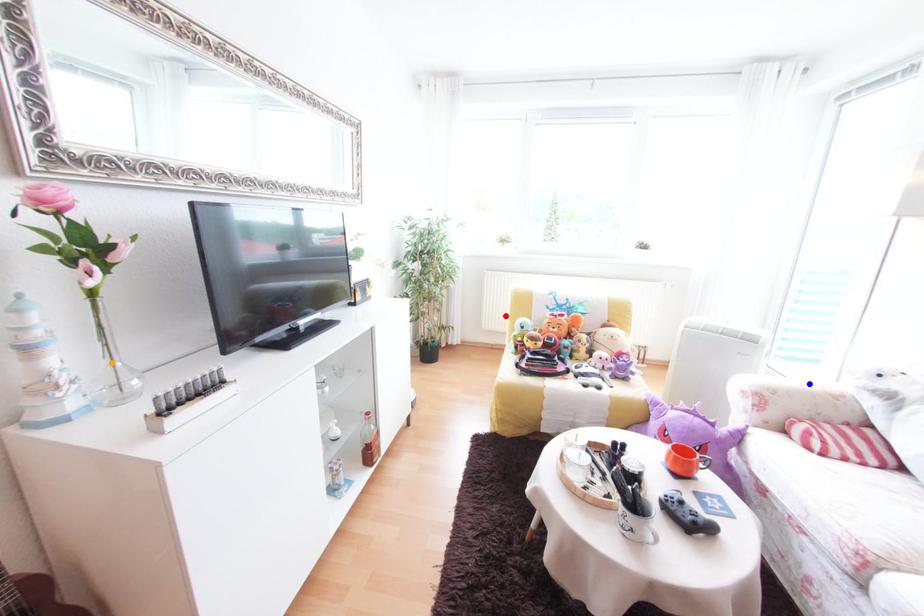
Order these from nearest to farthest:
red point
blue point
orange point

1. red point
2. blue point
3. orange point